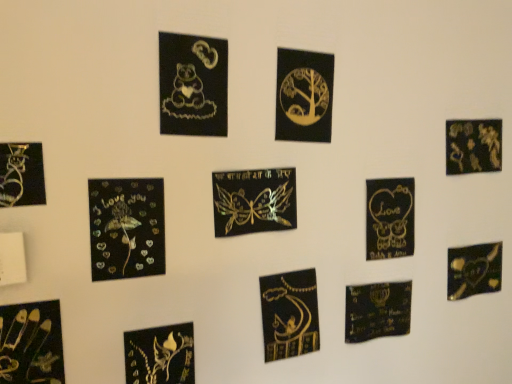
In order to click on gold metallic calligraphy at center, the 1th embroidery from the left in this screenshot , I will do `click(289, 314)`.

The width and height of the screenshot is (512, 384). Describe the element at coordinates (304, 96) in the screenshot. I see `gold metallic tree at upper center, the 7th picture frame in the left-to-right sequence` at that location.

In order to face gold metallic heart at center right, positioned as the second picture frame in right-to-left order, should I rotate leftwards or rightwards?

You should rotate right by 17.994 degrees.

You are a GUI agent. You are given a task and a screenshot of the screen. Output one action in this format:
    pyautogui.click(x=<x>, y=<y>)
    Task: Click on the gold metallic heart at center right, positioned as the second picture frame in right-to-left order
    
    Given the screenshot: What is the action you would take?
    pyautogui.click(x=389, y=218)

Locate an element on the screen. This screenshot has width=512, height=384. gold metallic flower at center left, which is the third picture frame in left-to-right order is located at coordinates (126, 228).

In order to click on matte black heart at lower center, the 2th embroidery when ordered from front to back in this screenshot , I will do `click(377, 311)`.

This screenshot has width=512, height=384. What do you see at coordinates (193, 85) in the screenshot? I see `matte gold bear at upper center, acting as the fifth picture frame starting from the right` at bounding box center [193, 85].

The width and height of the screenshot is (512, 384). I want to click on matte gold bear at upper center, acting as the fifth picture frame starting from the right, so click(x=193, y=85).

Describe the element at coordinates (254, 201) in the screenshot. I see `holographic gold butterflies at center, arranged as the sixth picture frame when viewed from the left` at that location.

What are the coordinates of `gold metallic calligraphy at center, the second embroidery from the back` in the screenshot? It's located at (289, 314).

Is matte black butterfly at lower left, the 1th picture frame in the left-to-right sequence, not within metallic gold butterfly at lower left, the fourth picture frame when ordered from left to right?

Absolutely, matte black butterfly at lower left, the 1th picture frame in the left-to-right sequence, is external to metallic gold butterfly at lower left, the fourth picture frame when ordered from left to right.

Would you say matte black butterfly at lower left, which appears as the ninth picture frame when viewed from the right, is a long distance from metallic gold butterfly at lower left, the fourth picture frame when ordered from left to right?

matte black butterfly at lower left, which appears as the ninth picture frame when viewed from the right, is actually quite close to metallic gold butterfly at lower left, the fourth picture frame when ordered from left to right.

Is matte black butterfly at lower left, which appears as the ninth picture frame when viewed from the right, taller or shorter than metallic gold butterfly at lower left, the 6th picture frame from the right?

Clearly, matte black butterfly at lower left, which appears as the ninth picture frame when viewed from the right, is shorter compared to metallic gold butterfly at lower left, the 6th picture frame from the right.

Which is more to the right, matte black butterfly at lower left, which appears as the ninth picture frame when viewed from the right, or metallic gold butterfly at lower left, the 6th picture frame from the right?

Positioned to the right is metallic gold butterfly at lower left, the 6th picture frame from the right.

Is metallic gold butterfly at lower left, the fourth picture frame when ordered from left to right, positioned far away from white matte switch at lower left?

That's not correct — metallic gold butterfly at lower left, the fourth picture frame when ordered from left to right, is a little close to white matte switch at lower left.

Can you confirm if metallic gold butterfly at lower left, the fourth picture frame when ordered from left to right, is thinner than white matte switch at lower left?

Yes, metallic gold butterfly at lower left, the fourth picture frame when ordered from left to right, is thinner than white matte switch at lower left.

Is metallic gold butterfly at lower left, the fourth picture frame when ordered from left to right, oriented towards white matte switch at lower left?

No.

From a real-world perspective, is metallic gold butterfly at lower left, the 6th picture frame from the right, positioned above or below white matte switch at lower left?

In terms of real-world spatial position, metallic gold butterfly at lower left, the 6th picture frame from the right, is below white matte switch at lower left.

Which of these two, metallic gold floral design at upper right, which is the 9th picture frame in left-to-right order, or gold metallic tree at upper center, the 7th picture frame in the left-to-right sequence, stands taller?

With more height is gold metallic tree at upper center, the 7th picture frame in the left-to-right sequence.

Is metallic gold floral design at upper right, the 1th picture frame when ordered from right to left, not within gold metallic tree at upper center, which ranks as the third picture frame in right-to-left order?

metallic gold floral design at upper right, the 1th picture frame when ordered from right to left, is positioned outside gold metallic tree at upper center, which ranks as the third picture frame in right-to-left order.

From the image's perspective, between metallic gold floral design at upper right, which is the 9th picture frame in left-to-right order, and gold metallic tree at upper center, which ranks as the third picture frame in right-to-left order, who is located below?

From the image's view, metallic gold floral design at upper right, which is the 9th picture frame in left-to-right order, is below.

Can you tell me how much metallic gold floral design at upper right, which is the 9th picture frame in left-to-right order, and gold metallic tree at upper center, the 7th picture frame in the left-to-right sequence, differ in facing direction?

They differ by 0.966 degrees in their facing directions.

Is metallic gold butterfly at lower left, the 6th picture frame from the right, taller than metallic gold heart at bottom right?

Yes, metallic gold butterfly at lower left, the 6th picture frame from the right, is taller than metallic gold heart at bottom right.

From a real-world perspective, is metallic gold butterfly at lower left, the 6th picture frame from the right, positioned above or below metallic gold heart at bottom right?

From a real-world perspective, metallic gold butterfly at lower left, the 6th picture frame from the right, is physically below metallic gold heart at bottom right.

Measure the distance from metallic gold butterfly at lower left, the 6th picture frame from the right, to metallic gold heart at bottom right.

metallic gold butterfly at lower left, the 6th picture frame from the right, is 31.77 inches from metallic gold heart at bottom right.

Between metallic gold heart at bottom right and gold metallic heart at center right, positioned as the second picture frame in right-to-left order, which one has larger size?

Bigger between the two is metallic gold heart at bottom right.

Does metallic gold heart at bottom right turn towards gold metallic heart at center right, placed as the 8th picture frame when sorted from left to right?

No, metallic gold heart at bottom right is not aimed at gold metallic heart at center right, placed as the 8th picture frame when sorted from left to right.

Image resolution: width=512 pixels, height=384 pixels. I want to click on postcard behind the gold metallic heart at center right, positioned as the second picture frame in right-to-left order, so click(474, 270).

Is metallic gold heart at bottom right shorter than gold metallic heart at center right, placed as the 8th picture frame when sorted from left to right?

Correct, metallic gold heart at bottom right is not as tall as gold metallic heart at center right, placed as the 8th picture frame when sorted from left to right.

Is the position of matte black butterfly at lower left, the 1th picture frame in the left-to-right sequence, more distant than that of matte gold bear at upper center, the 5th picture frame viewed from the left?

No, matte black butterfly at lower left, the 1th picture frame in the left-to-right sequence, is in front of matte gold bear at upper center, the 5th picture frame viewed from the left.

From a real-world perspective, is matte black butterfly at lower left, which appears as the ninth picture frame when viewed from the right, located higher than matte gold bear at upper center, acting as the fifth picture frame starting from the right?

Incorrect, from a real-world perspective, matte black butterfly at lower left, which appears as the ninth picture frame when viewed from the right, is lower than matte gold bear at upper center, acting as the fifth picture frame starting from the right.

Which picture frame is the 4th one when counting from the right side of the matte black butterfly at lower left, which appears as the ninth picture frame when viewed from the right? Please provide its 2D coordinates.

[(193, 85)]

Is point (39, 178) closer or farther from the camera than point (160, 127)?

Point (39, 178) is closer to the camera than point (160, 127).

Between holographic gold butterflies at center, the 4th picture frame positioned from the right, and gold metallic tree at upper center, which ranks as the third picture frame in right-to-left order, which one appears on the left side from the viewer's perspective?

From the viewer's perspective, holographic gold butterflies at center, the 4th picture frame positioned from the right, appears more on the left side.

Which is nearer, (241,183) or (283,81)?

Point (241,183) appears to be closer to the viewer than point (283,81).

Is holographic gold butterflies at center, the 4th picture frame positioned from the right, not close to gold metallic tree at upper center, which ranks as the third picture frame in right-to-left order?

holographic gold butterflies at center, the 4th picture frame positioned from the right, is near gold metallic tree at upper center, which ranks as the third picture frame in right-to-left order, not far away.

From a real-world perspective, which is physically above, holographic gold butterflies at center, arranged as the sixth picture frame when viewed from the left, or gold metallic tree at upper center, the 7th picture frame in the left-to-right sequence?

In real-world perspective, gold metallic tree at upper center, the 7th picture frame in the left-to-right sequence, is above.

You are a GUI agent. You are given a task and a screenshot of the screen. Output one action in this format:
    pyautogui.click(x=<x>, y=<y>)
    Task: Click on the 5th picture frame below when counting from the matte black butterfly at lower left, which appears as the ninth picture frame when viewed from the right (from the image's perspective)
    
    Given the screenshot: What is the action you would take?
    pyautogui.click(x=160, y=355)

Identify the location of plaque located on the left of metallic gold butterfly at lower left, the fourth picture frame when ordered from left to right. Image resolution: width=512 pixels, height=384 pixels. (12, 259).

Considering their positions, is white matte switch at lower left positioned closer to metallic gold butterfly at lower left, the 6th picture frame from the right, than gold metallic heart at center right, placed as the 8th picture frame when sorted from left to right?

white matte switch at lower left.

Estimate the real-world distances between objects in this image. Which object is further from metallic gold butterfly at lower left, the fourth picture frame when ordered from left to right, matte black butterfly at lower left, which appears as the ninth picture frame when viewed from the right, or white matte switch at lower left?

matte black butterfly at lower left, which appears as the ninth picture frame when viewed from the right.

Estimate the real-world distances between objects in this image. Which object is further from gold metallic calligraphy at center, the 1th embroidery from the left, gold metallic flower at center left, which is the third picture frame in left-to-right order, or metallic gold butterfly at lower left, the 6th picture frame from the right?

gold metallic flower at center left, which is the third picture frame in left-to-right order, lies further to gold metallic calligraphy at center, the 1th embroidery from the left, than the other object.

Looking at the image, which one is located closer to gold metallic calligraphy at center, which appears as the 1th embroidery when viewed from the front, metallic gold heart at bottom right or holographic gold butterflies at center, arranged as the sixth picture frame when viewed from the left?

holographic gold butterflies at center, arranged as the sixth picture frame when viewed from the left, is positioned closer to the anchor gold metallic calligraphy at center, which appears as the 1th embroidery when viewed from the front.

Based on their spatial positions, is gold metallic tree at upper center, which ranks as the third picture frame in right-to-left order, or gold metallic flower at center left, which is the third picture frame in left-to-right order, further from holographic gold butterflies at center, the 4th picture frame positioned from the right?

Based on the image, gold metallic flower at center left, which is the third picture frame in left-to-right order, appears to be further to holographic gold butterflies at center, the 4th picture frame positioned from the right.

Based on their spatial positions, is gold metallic flower at center left, which is the third picture frame in left-to-right order, or white matte switch at lower left closer to gold metallic tree at upper center, which ranks as the third picture frame in right-to-left order?

gold metallic flower at center left, which is the third picture frame in left-to-right order, is positioned closer to the anchor gold metallic tree at upper center, which ranks as the third picture frame in right-to-left order.

Estimate the real-world distances between objects in this image. Which object is further from gold metallic flower at center left, the seventh picture frame from the right, holographic gold butterflies at center, the 4th picture frame positioned from the right, or gold metallic calligraphy at center, the 1th embroidery from the left?

The object further to gold metallic flower at center left, the seventh picture frame from the right, is gold metallic calligraphy at center, the 1th embroidery from the left.

When comparing their distances from white matte switch at lower left, does gold metallic calligraphy at center, the 2th embroidery when ordered from right to left, or gold metallic flower at center left, which is the third picture frame in left-to-right order, seem closer?

The object closer to white matte switch at lower left is gold metallic flower at center left, which is the third picture frame in left-to-right order.

The width and height of the screenshot is (512, 384). Identify the location of plaque situated between matte black butterfly at lower left, which appears as the ninth picture frame when viewed from the right, and gold metallic heart at center right, positioned as the second picture frame in right-to-left order, from left to right. (12, 259).

Locate an element on the screen. This screenshot has width=512, height=384. embroidery located between gold metallic calligraphy at center, the 1th embroidery from the left, and gold metallic heart at center right, placed as the 8th picture frame when sorted from left to right, in the left-right direction is located at coordinates (377, 311).

This screenshot has width=512, height=384. Find the location of `embroidery between gold metallic flower at center left, the seventh picture frame from the right, and matte black heart at lower center, the 1th embroidery from the right, from left to right`. embroidery between gold metallic flower at center left, the seventh picture frame from the right, and matte black heart at lower center, the 1th embroidery from the right, from left to right is located at coordinates (289, 314).

Where is `embroidery between matte black butterfly at lower left, which appears as the ninth picture frame when viewed from the right, and matte black heart at lower center, the 2th embroidery when ordered from front to back, in the horizontal direction`? embroidery between matte black butterfly at lower left, which appears as the ninth picture frame when viewed from the right, and matte black heart at lower center, the 2th embroidery when ordered from front to back, in the horizontal direction is located at coordinates [x=289, y=314].